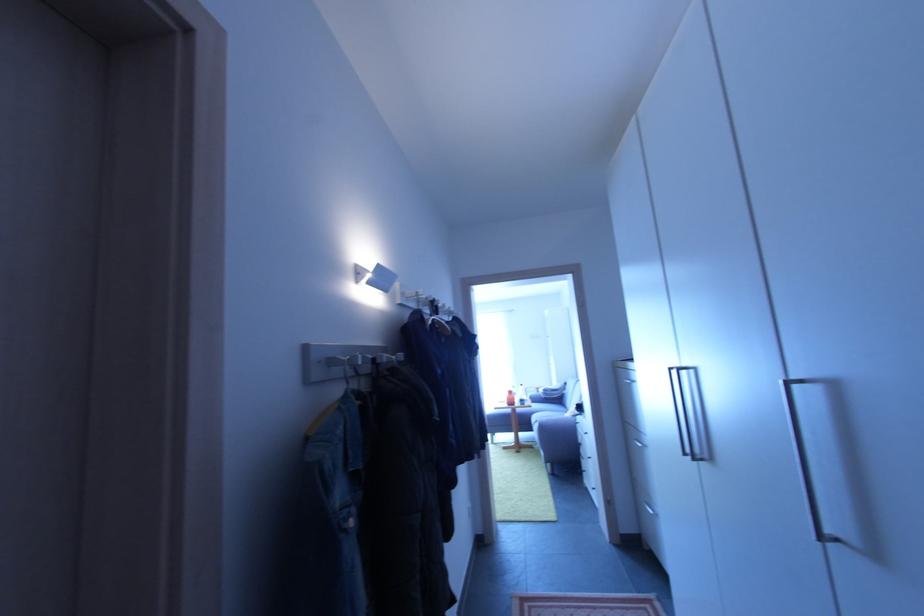
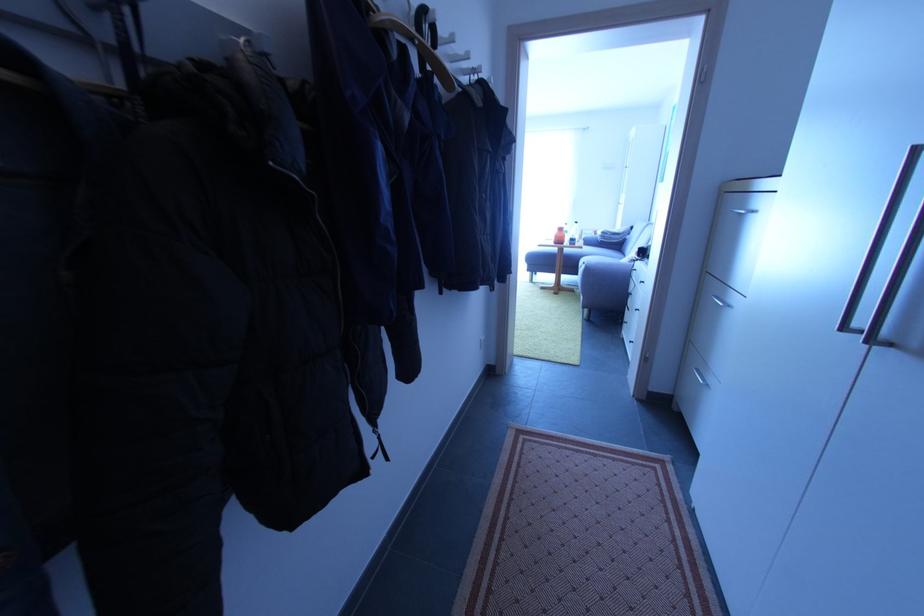
Where in the second image is the point corresponding to (509,402) from the first image?

(557, 238)